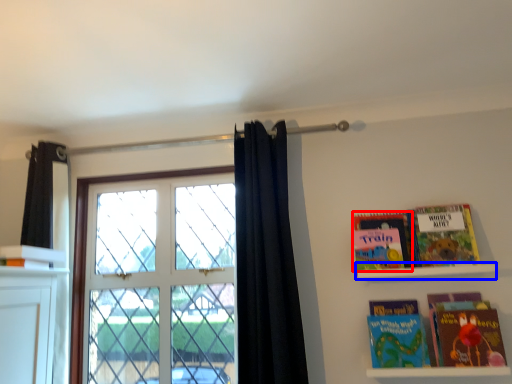
Question: Which object is further to the camera taking this photo, book (highlighted by a red box) or shelf (highlighted by a blue box)?

Choices:
 (A) book
 (B) shelf

Answer: (A)